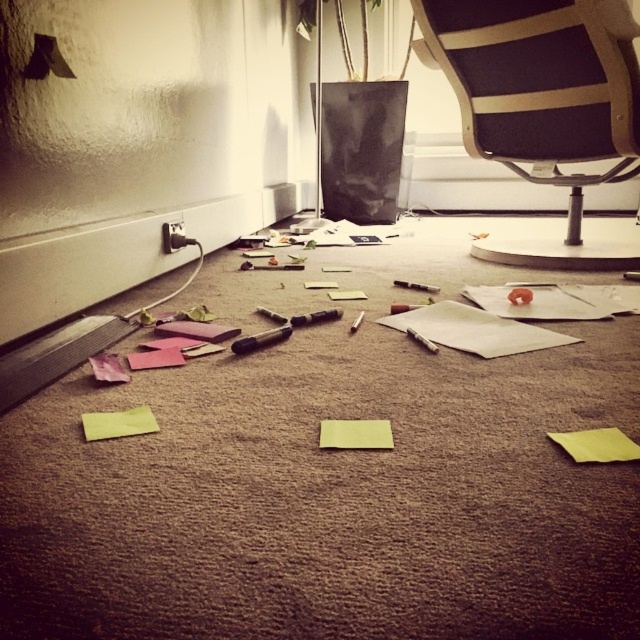
You are organizing your workspace and need to place both the yellow matte sticky note at center and the black plastic screwdriver at center into a drawer. Which item will require more space horizontally?

The black plastic screwdriver at center requires more horizontal space because its width is greater than the yellow matte sticky note at center.